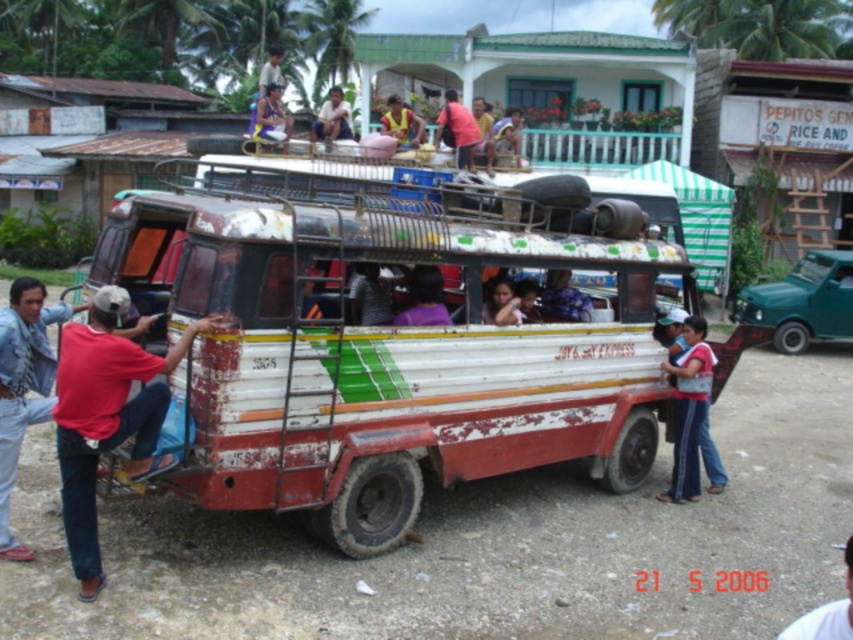
Based on the photo, you are a passenger in the vehicle and need to decide which shirt to grab first. The red matte shirt at left and the matte purple shirt at center are both within your reach. Which shirt is closer to you?

The red matte shirt at left is taller than the matte purple shirt at center, so it is further away from you. Therefore, the matte purple shirt at center is closer to you and easier to grab first.

You are a passenger in the vehicle and want to place a small bag on the roof. You see the red matte shirt at left and the purple fabric at center. Which object is closer to the edge of the roof where you can safely place your bag?

The red matte shirt at left is positioned under the purple fabric at center, so the purple fabric at center is closer to the edge of the roof and safer for placing the bag.